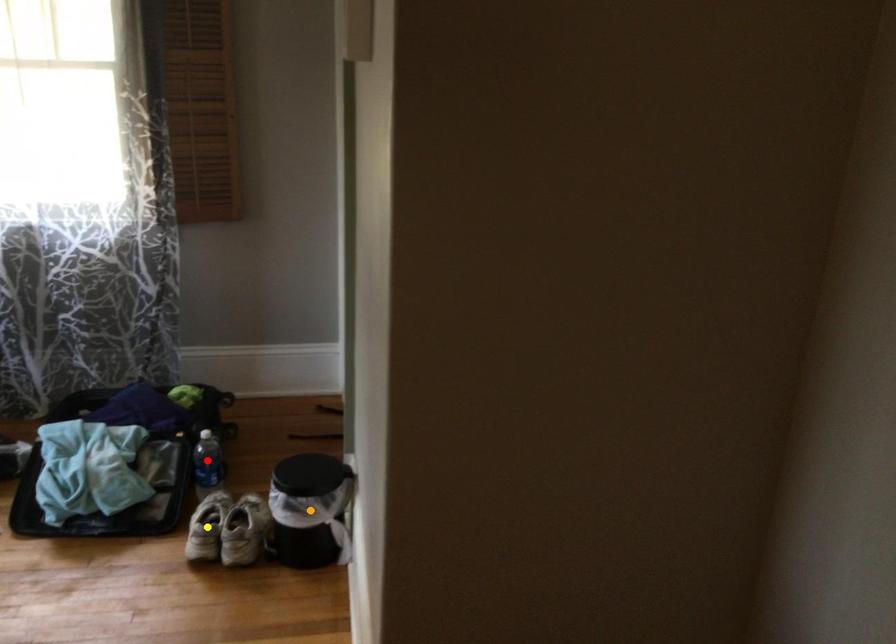
Order these from nearest to farthest:
1. red point
2. yellow point
3. orange point

orange point, yellow point, red point